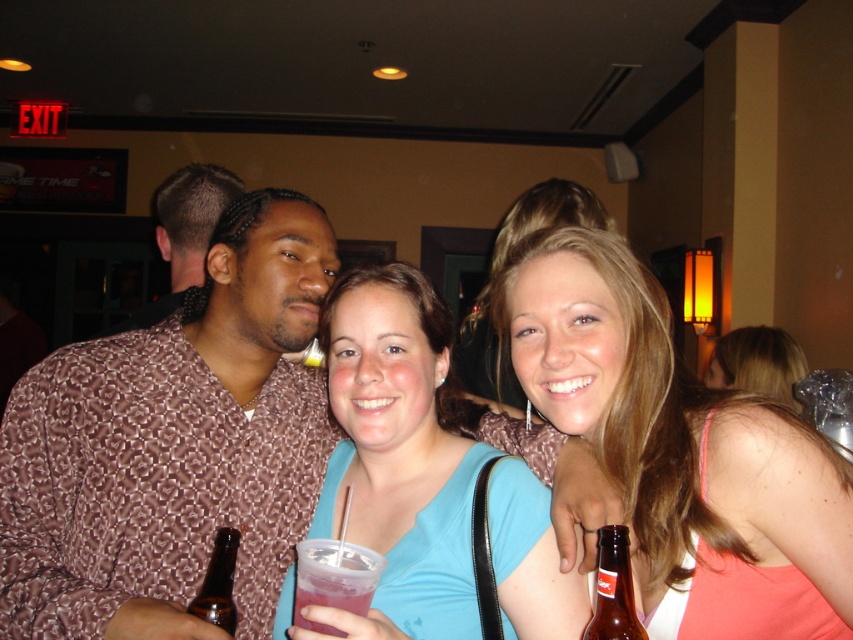
Between blonde hair at upper right and brown glass bottle at lower right, which one is positioned lower?

brown glass bottle at lower right is below.

Can you confirm if blonde hair at upper right is taller than brown glass bottle at lower right?

Indeed, blonde hair at upper right has a greater height compared to brown glass bottle at lower right.

Is point (747, 392) closer to viewer compared to point (602, 561)?

No.

This screenshot has width=853, height=640. Find the location of `blonde hair at upper right`. blonde hair at upper right is located at coordinates (757, 364).

Who is taller, blonde hair at center or brown glass bottle at lower right?

Answer: With more height is blonde hair at center.

Can you confirm if blonde hair at center is positioned to the right of brown glass bottle at lower right?

Indeed, blonde hair at center is positioned on the right side of brown glass bottle at lower right.

Find the location of `blonde hair at center`. blonde hair at center is located at coordinates (682, 448).

Can you confirm if blue fabric shirt at center is positioned below blonde hair at upper right?

Yes, blue fabric shirt at center is below blonde hair at upper right.

What do you see at coordinates (398, 454) in the screenshot? The image size is (853, 640). I see `blue fabric shirt at center` at bounding box center [398, 454].

Is point (426, 624) less distant than point (770, 362)?

Yes, point (426, 624) is closer to viewer.

Find the location of a particular element. blue fabric shirt at center is located at coordinates (398, 454).